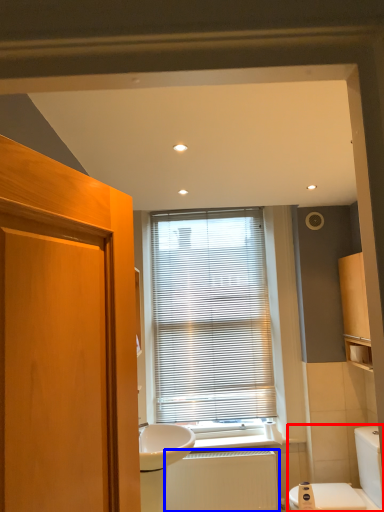
Question: Which object appears closest to the camera in this image, toilet (highlighted by a red box) or radiator (highlighted by a blue box)?

Choices:
 (A) toilet
 (B) radiator

Answer: (A)